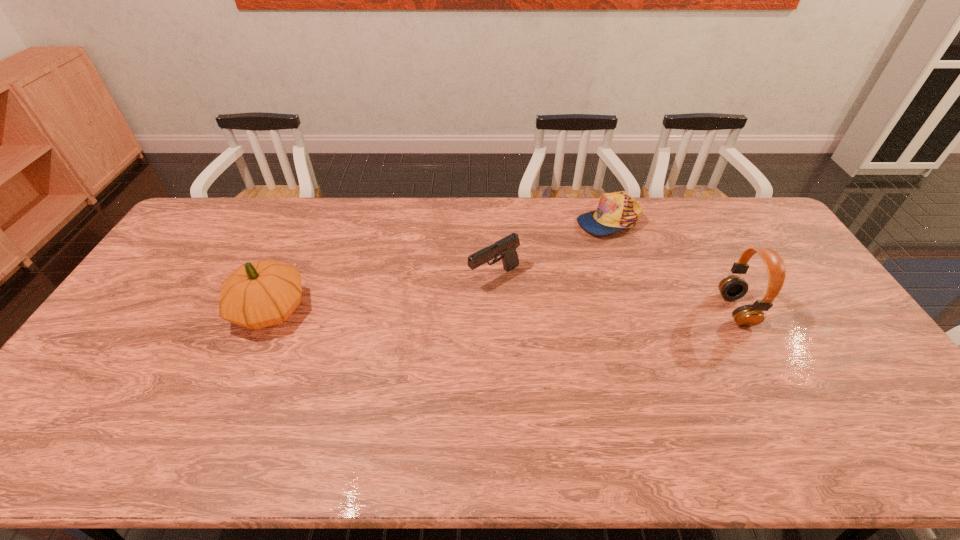
Locate an element on the screen. gourd is located at coordinates (264, 293).

Find the location of a particular element. This screenshot has width=960, height=540. the leftmost object is located at coordinates (264, 293).

I want to click on headset, so click(x=732, y=287).

Where is `the second object from left to right`? This screenshot has width=960, height=540. the second object from left to right is located at coordinates click(x=506, y=247).

What are the coordinates of `the third tallest object` in the screenshot? It's located at (506, 247).

The width and height of the screenshot is (960, 540). I want to click on the farthest object, so click(x=616, y=211).

This screenshot has width=960, height=540. I want to click on the third object from left to right, so click(x=616, y=211).

This screenshot has height=540, width=960. I want to click on vacant point located on the side of the leftmost object with the carved face, so pyautogui.click(x=150, y=309).

The image size is (960, 540). What are the coordinates of `free region located 0.150m on the side of the leftmost object with the carved face` in the screenshot? It's located at (180, 309).

Where is `vacant region located 0.310m on the side of the leftmost object with the carved face`? The height and width of the screenshot is (540, 960). vacant region located 0.310m on the side of the leftmost object with the carved face is located at coordinates (126, 309).